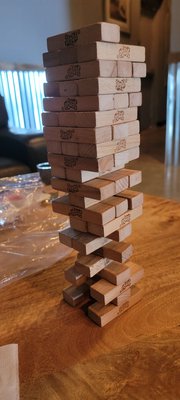
The height and width of the screenshot is (400, 180). Identify the location of carpet. (156, 151), (153, 137).